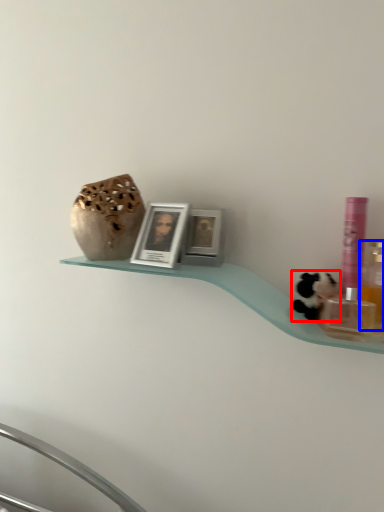
Question: Which object appears farthest to the camera in this image, animal (highlighted by a red box) or mouthwash (highlighted by a blue box)?

Choices:
 (A) animal
 (B) mouthwash

Answer: (A)